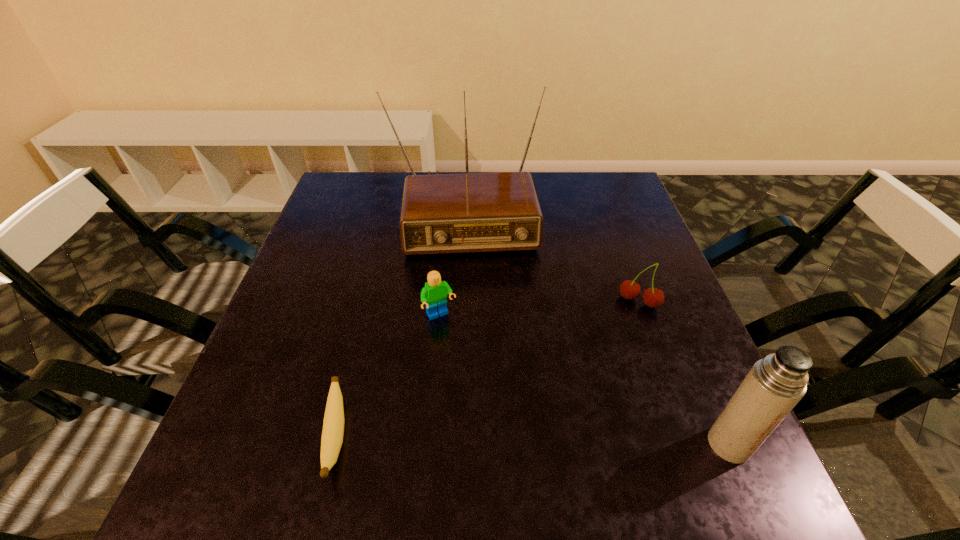
I want to click on free space between the shortest object and the cherry, so pos(488,368).

Find the location of a particular element. unoccupied area between the thermos bottle and the Lego is located at coordinates (585, 380).

I want to click on free spot between the Lego and the cherry, so click(x=540, y=308).

I want to click on vacant space that's between the second tallest object and the Lego, so click(585, 380).

Locate an element on the screen. This screenshot has width=960, height=540. vacant area that lies between the farthest object and the Lego is located at coordinates (452, 263).

This screenshot has height=540, width=960. Identify the location of free point between the radio_receiver and the cherry. (552, 255).

Locate an element on the screen. This screenshot has height=540, width=960. free space that is in between the farthest object and the cherry is located at coordinates (552, 255).

Locate an element on the screen. Image resolution: width=960 pixels, height=540 pixels. free space that is in between the tallest object and the thermos bottle is located at coordinates (597, 327).

You are a GUI agent. You are given a task and a screenshot of the screen. Output one action in this format:
    pyautogui.click(x=<x>, y=<y>)
    Task: Click on the free space that is in between the tallest object and the thermos bottle
    The image size is (960, 540).
    Given the screenshot: What is the action you would take?
    [x=597, y=327]

Point out which object is positioned as the third nearest to the radio_receiver. Please provide its 2D coordinates. Your answer should be formatted as a tuple, i.e. [(x, y)], where the tuple contains the x and y coordinates of a point satisfying the conditions above.

[(333, 426)]